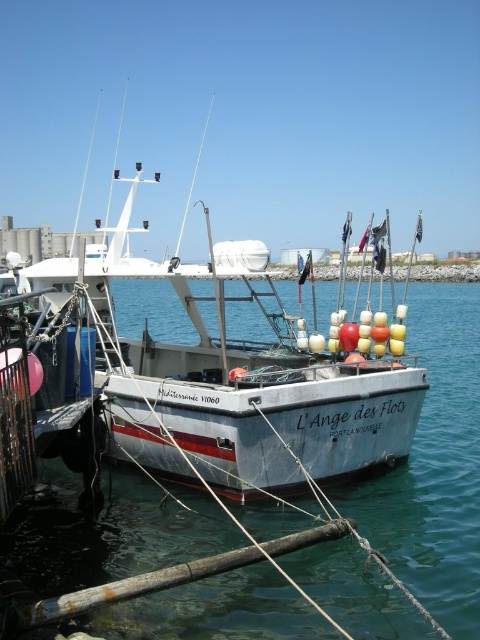
You are standing on the dock next to the fishing boat LAnge des Flots. There is a point at coordinates point (379, 625). If you want to reach a point that is 8.14 meters away from it, which direction should you move in relation to the boat?

The point at coordinates point (379, 625) is 8.14 meters away from the boat, so you should move away from the boat to reach the desired point.

You are standing on the wooden dock and looking at the clear blue water at center and the white matte fishing boat at center. Which object is located lower in the image?

The clear blue water at center is located lower than the white matte fishing boat at center in the image.